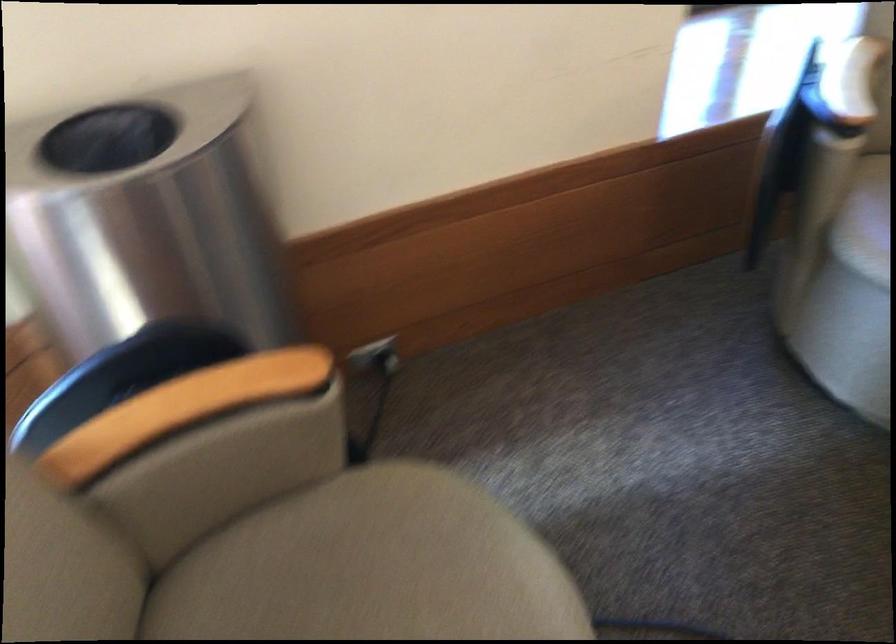
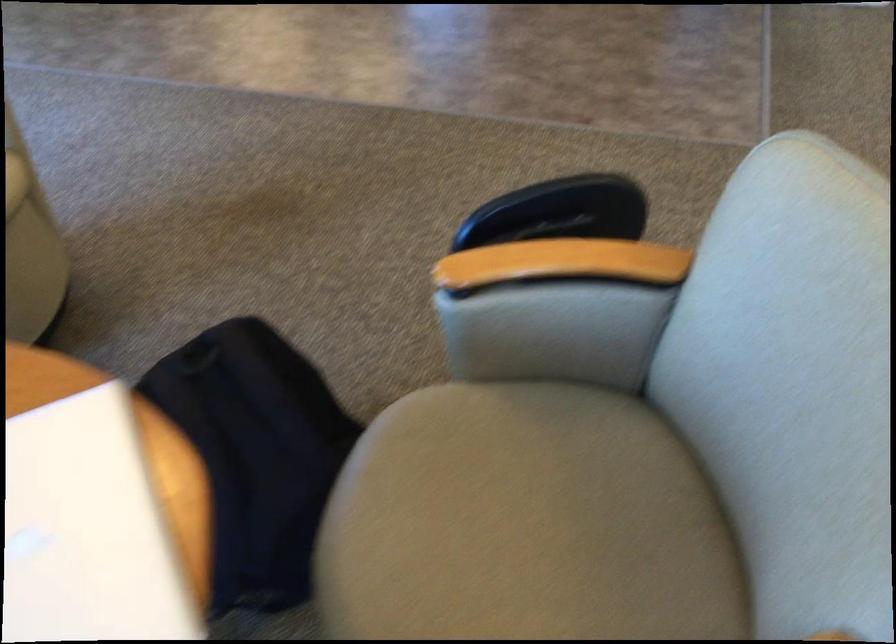
How did the camera likely rotate?

The rotation direction of the camera is right-down.